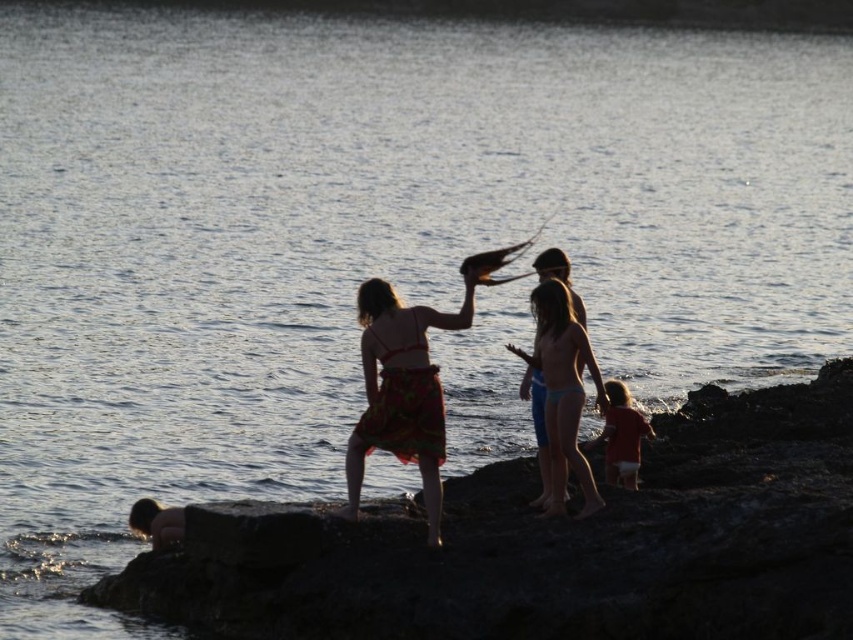
Which is below, silhouette floral skirt at center or matte pink bikini at center?

matte pink bikini at center

Is the position of silhouette floral skirt at center less distant than that of matte pink bikini at center?

That is False.

Between point (418, 323) and point (567, 419), which one is positioned behind?

The point (567, 419) is more distant.

The width and height of the screenshot is (853, 640). I want to click on silhouette floral skirt at center, so click(x=408, y=381).

Does point (369, 340) lie behind point (616, 461)?

No, it is in front of (616, 461).

Does silhouette floral skirt at center appear under red matte shirt at lower right?

No, silhouette floral skirt at center is not below red matte shirt at lower right.

Image resolution: width=853 pixels, height=640 pixels. What do you see at coordinates (408, 381) in the screenshot?
I see `silhouette floral skirt at center` at bounding box center [408, 381].

This screenshot has width=853, height=640. Identify the location of silhouette floral skirt at center. [x=408, y=381].

Can you confirm if matte pink bikini at center is positioned to the left of red matte shirt at lower right?

Correct, you'll find matte pink bikini at center to the left of red matte shirt at lower right.

Is matte pink bikini at center behind red matte shirt at lower right?

No, it is in front of red matte shirt at lower right.

Who is more forward, [576,460] or [639,445]?

Point [576,460] is in front.

Identify the location of matte pink bikini at center. Image resolution: width=853 pixels, height=640 pixels. 561,392.